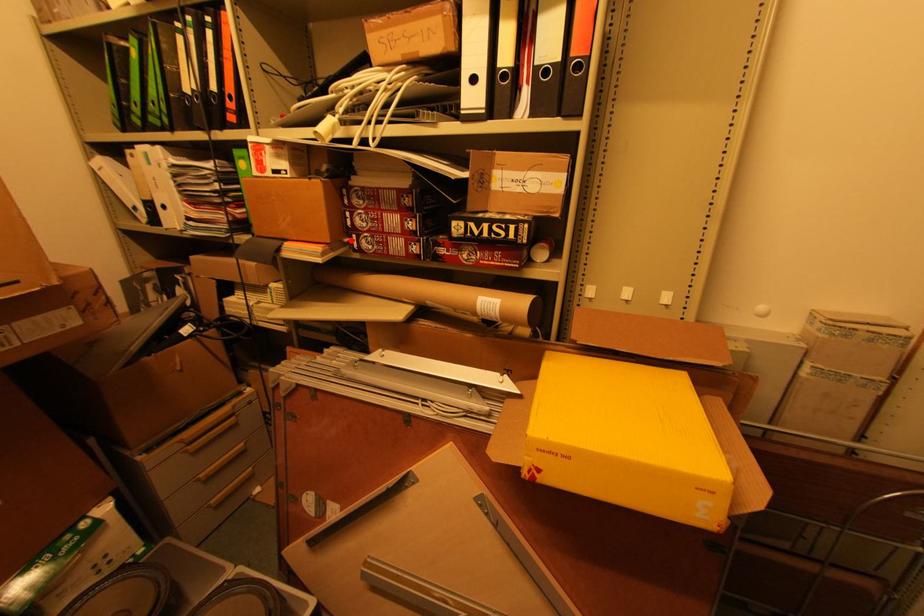
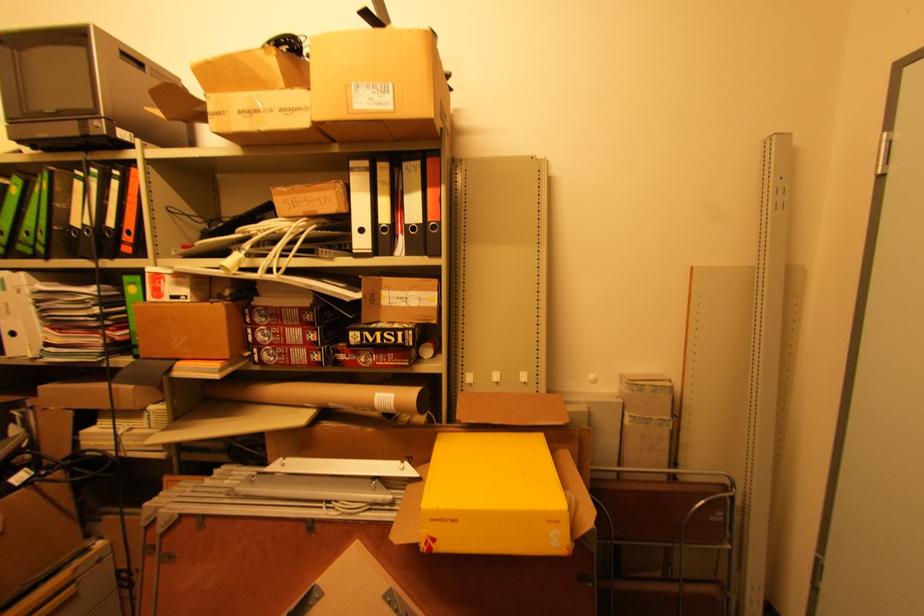
Find the pixel in the second image that matches the highlighted location in the first image.

(251, 354)